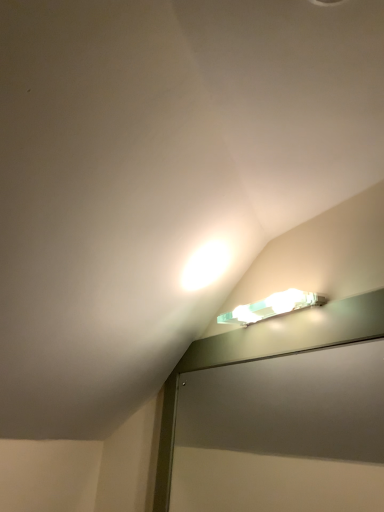
Question: Is clear glass screen door at upper center smaller than translucent plastic light fixture at upper right?

Choices:
 (A) no
 (B) yes

Answer: (A)

Question: Considering the relative sizes of clear glass screen door at upper center and translucent plastic light fixture at upper right in the image provided, is clear glass screen door at upper center taller than translucent plastic light fixture at upper right?

Choices:
 (A) no
 (B) yes

Answer: (B)

Question: Considering the relative positions of clear glass screen door at upper center and translucent plastic light fixture at upper right in the image provided, is clear glass screen door at upper center to the right of translucent plastic light fixture at upper right from the viewer's perspective?

Choices:
 (A) yes
 (B) no

Answer: (B)

Question: From the image's perspective, is clear glass screen door at upper center under translucent plastic light fixture at upper right?

Choices:
 (A) no
 (B) yes

Answer: (B)

Question: Considering the relative sizes of clear glass screen door at upper center and translucent plastic light fixture at upper right in the image provided, is clear glass screen door at upper center thinner than translucent plastic light fixture at upper right?

Choices:
 (A) no
 (B) yes

Answer: (B)

Question: From a real-world perspective, is clear glass screen door at upper center located beneath translucent plastic light fixture at upper right?

Choices:
 (A) no
 (B) yes

Answer: (B)

Question: Is translucent plastic light fixture at upper right further to the viewer compared to clear glass screen door at upper center?

Choices:
 (A) yes
 (B) no

Answer: (A)

Question: Is translucent plastic light fixture at upper right not near clear glass screen door at upper center?

Choices:
 (A) yes
 (B) no

Answer: (B)

Question: Is translucent plastic light fixture at upper right positioned beyond the bounds of clear glass screen door at upper center?

Choices:
 (A) yes
 (B) no

Answer: (A)

Question: Considering the relative sizes of translucent plastic light fixture at upper right and clear glass screen door at upper center in the image provided, is translucent plastic light fixture at upper right thinner than clear glass screen door at upper center?

Choices:
 (A) no
 (B) yes

Answer: (A)

Question: Can you confirm if translucent plastic light fixture at upper right is bigger than clear glass screen door at upper center?

Choices:
 (A) no
 (B) yes

Answer: (A)

Question: From a real-world perspective, is translucent plastic light fixture at upper right under clear glass screen door at upper center?

Choices:
 (A) no
 (B) yes

Answer: (A)

Question: Is translucent plastic light fixture at upper right taller or shorter than clear glass screen door at upper center?

Choices:
 (A) tall
 (B) short

Answer: (B)